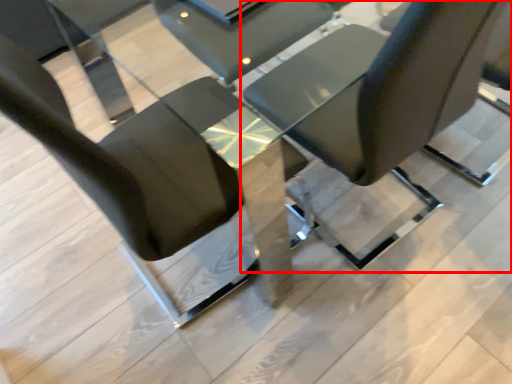
Question: From the image's perspective, what is the correct spatial positioning of chair (annotated by the red box) in reference to chair?

Choices:
 (A) above
 (B) below

Answer: (A)